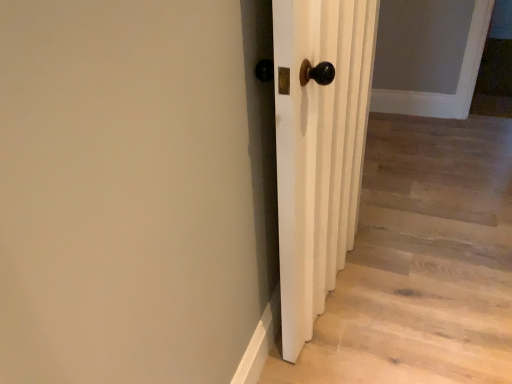
Image resolution: width=512 pixels, height=384 pixels. In order to click on free point above white matte door at center (from a real-world perspective) in this screenshot , I will do `click(416, 235)`.